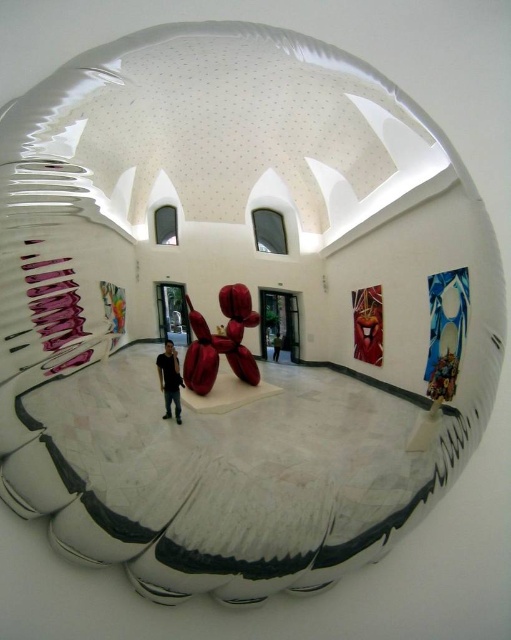
Is shiny metallic balloon dog at center taller than dark brown leather jacket at center?

Yes, shiny metallic balloon dog at center is taller than dark brown leather jacket at center.

Is shiny metallic balloon dog at center to the left of dark brown leather jacket at center from the viewer's perspective?

Correct, you'll find shiny metallic balloon dog at center to the left of dark brown leather jacket at center.

Locate an element on the screen. The height and width of the screenshot is (640, 511). shiny metallic balloon dog at center is located at coordinates (220, 340).

Between metallic red sculpture at right and dark brown leather jacket at center, which one has less height?

Standing shorter between the two is dark brown leather jacket at center.

Which is in front, point (360, 323) or point (275, 337)?

Point (275, 337) is more forward.

Is point (381, 314) positioned before point (272, 340)?

No, it is behind (272, 340).

Where is `metallic red sculpture at right`? The image size is (511, 640). metallic red sculpture at right is located at coordinates (367, 324).

Is point (193, 308) in front of point (363, 300)?

Yes, it is in front of point (363, 300).

Does shiny metallic balloon dog at center appear under metallic red sculpture at right?

Correct, shiny metallic balloon dog at center is located below metallic red sculpture at right.

Is point (222, 352) less distant than point (361, 321)?

Yes, it is in front of point (361, 321).

Find the location of `shiny metallic balloon dog at center`. shiny metallic balloon dog at center is located at coordinates (220, 340).